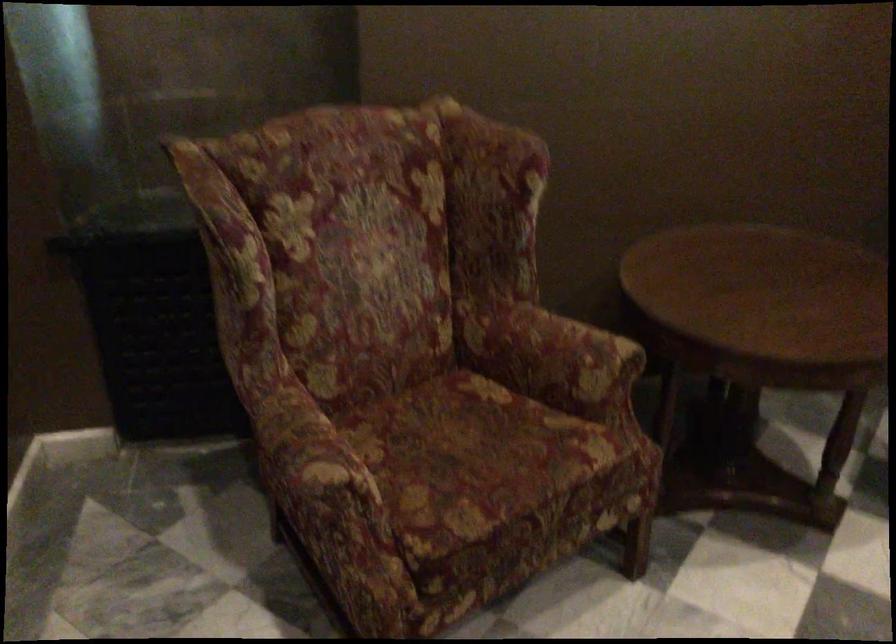
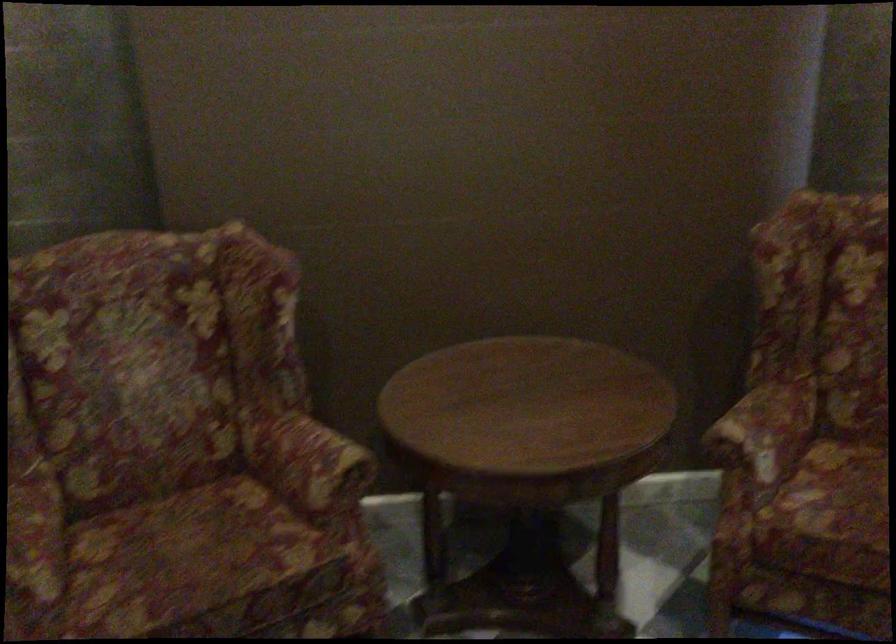
Question: How did the camera likely rotate?

Choices:
 (A) Left
 (B) Right
 (C) Up
 (D) Down

Answer: (C)